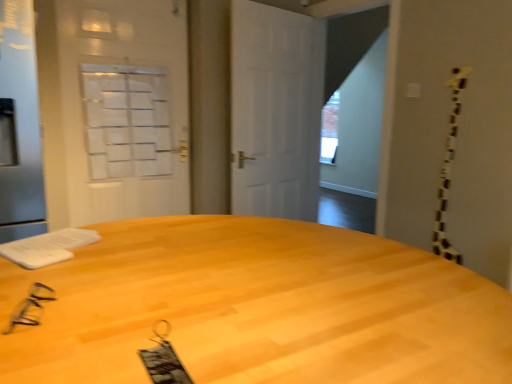
Question: Does white matte door at center have a greater width compared to black plastic glasses at lower left?

Choices:
 (A) no
 (B) yes

Answer: (A)

Question: Is white matte door at center taller than black plastic glasses at lower left?

Choices:
 (A) no
 (B) yes

Answer: (B)

Question: From the image's perspective, is white matte door at center under black plastic glasses at lower left?

Choices:
 (A) no
 (B) yes

Answer: (A)

Question: Does white matte door at center have a lesser height compared to black plastic glasses at lower left?

Choices:
 (A) no
 (B) yes

Answer: (A)

Question: Does white matte door at center appear on the left side of black plastic glasses at lower left?

Choices:
 (A) no
 (B) yes

Answer: (A)

Question: Is point (49, 152) positioned closer to the camera than point (248, 6)?

Choices:
 (A) closer
 (B) farther

Answer: (A)

Question: Considering the positions of white frosted glass screen door at upper left, which ranks as the 1th screen door in back-to-front order, and white matte door at center in the image, is white frosted glass screen door at upper left, which ranks as the 1th screen door in back-to-front order, taller or shorter than white matte door at center?

Choices:
 (A) tall
 (B) short

Answer: (B)

Question: Is white frosted glass screen door at upper left, which ranks as the 1th screen door in back-to-front order, inside or outside of white matte door at center?

Choices:
 (A) outside
 (B) inside

Answer: (A)

Question: Is white frosted glass screen door at upper left, the 2th screen door positioned from the front, wider or thinner than white matte door at center?

Choices:
 (A) wide
 (B) thin

Answer: (B)

Question: Considering the positions of light wood desk at center and silver metallic screen door at left, which is the second screen door in back-to-front order, in the image, is light wood desk at center bigger or smaller than silver metallic screen door at left, which is the second screen door in back-to-front order,?

Choices:
 (A) small
 (B) big

Answer: (B)

Question: Is point (109, 231) closer or farther from the camera than point (3, 66)?

Choices:
 (A) farther
 (B) closer

Answer: (B)

Question: Looking at their shapes, would you say light wood desk at center is wider or thinner than silver metallic screen door at left, which is the 1th screen door in front-to-back order?

Choices:
 (A) wide
 (B) thin

Answer: (A)

Question: In the image, is light wood desk at center positioned in front of or behind silver metallic screen door at left, which is the second screen door in back-to-front order?

Choices:
 (A) front
 (B) behind

Answer: (A)

Question: From the image's perspective, relative to white frosted glass screen door at upper left, the 2th screen door positioned from the front, is silver metallic screen door at left, which is the 1th screen door in front-to-back order, above or below?

Choices:
 (A) above
 (B) below

Answer: (B)

Question: In terms of width, does silver metallic screen door at left, which is the 1th screen door in front-to-back order, look wider or thinner when compared to white frosted glass screen door at upper left, which ranks as the 1th screen door in back-to-front order?

Choices:
 (A) wide
 (B) thin

Answer: (A)